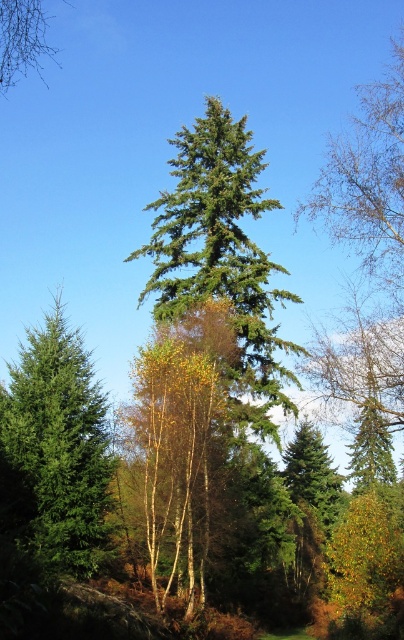
You are a hiker trying to identify the tallest tree in the forest. You notice a green matte tree at center and bare branches at upper left. Which tree should you consider taller?

The bare branches at upper left are taller than the green matte tree at center.

You are standing at the point labeled as point (222, 257) in the forest scene. What type of tree is directly located at this point?

The point (222, 257) corresponds to the green matte tree at center.

You are standing in the forest scene and want to locate the green matte tree at center. According to the image coordinates, where exactly is it positioned?

The green matte tree at center is positioned at coordinates point [222,257].